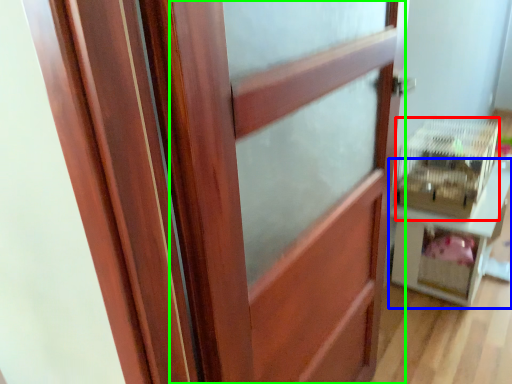
Question: Estimate the real-world distances between objects in this image. Which object is closer to crate (highlighted by a red box), furniture (highlighted by a blue box) or barn door (highlighted by a green box)?

Choices:
 (A) furniture
 (B) barn door

Answer: (A)